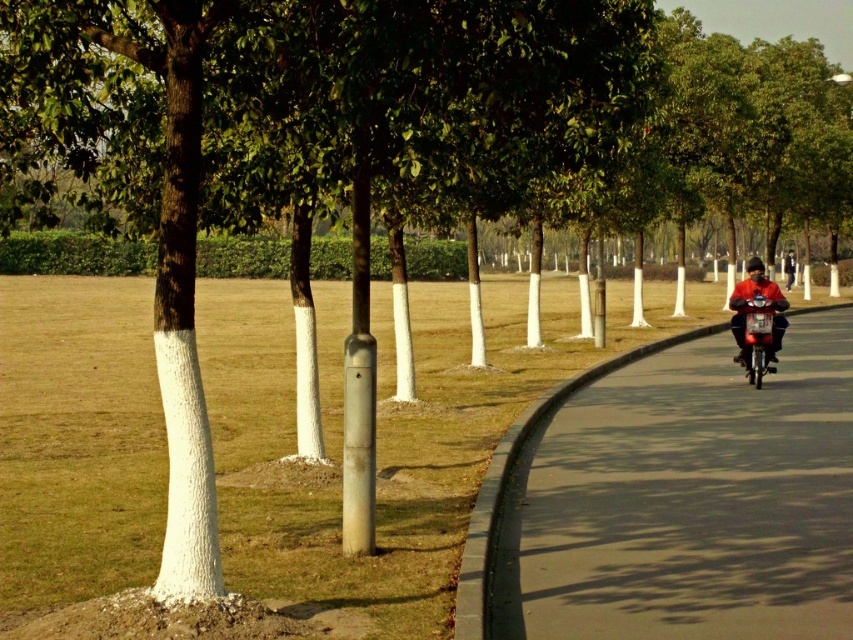
Question: Is smooth asphalt road at right closer to camera compared to red matte jacket at right?

Choices:
 (A) yes
 (B) no

Answer: (A)

Question: Which of the following is the farthest from the observer?

Choices:
 (A) smooth asphalt road at right
 (B) red matte jacket at right

Answer: (B)

Question: Does smooth asphalt road at right have a lesser width compared to red matte jacket at right?

Choices:
 (A) no
 (B) yes

Answer: (A)

Question: Does smooth asphalt road at right have a lesser width compared to red matte jacket at right?

Choices:
 (A) yes
 (B) no

Answer: (B)

Question: Which object is closer to the camera taking this photo?

Choices:
 (A) smooth asphalt road at right
 (B) red matte jacket at right

Answer: (A)

Question: Which of the following is the farthest from the observer?

Choices:
 (A) click(x=654, y=468)
 (B) click(x=746, y=298)

Answer: (B)